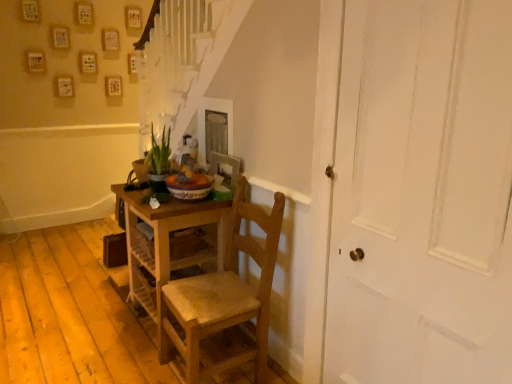
Describe the element at coordinates (166, 246) in the screenshot. This screenshot has height=384, width=512. I see `wooden desk at center` at that location.

Where is `white painted wood door at right`? white painted wood door at right is located at coordinates (422, 195).

Measure the distance between point (169, 305) and camera.

Point (169, 305) and camera are 2.09 meters apart.

Identify the location of green glossy plant at center. click(x=159, y=161).

Identify the location of wooden desk at center. The height and width of the screenshot is (384, 512). (166, 246).

From the image's perspective, who appears lower, wooden chair at center or green glossy plant at center?

wooden chair at center, from the image's perspective.

Looking at this image, is wooden chair at center looking in the opposite direction of green glossy plant at center?

No, wooden chair at center is not facing away from green glossy plant at center.

Is wooden chair at center far from green glossy plant at center?

They are positioned close to each other.

Which point is more forward, (269, 225) or (152, 141)?

The point (269, 225) is more forward.

Based on the photo, would you consider wooden picture frame at center to be distant from white painted wood door at right?

Yes, wooden picture frame at center and white painted wood door at right are quite far apart.

In the scene shown: From a real-world perspective, which object stands above the other?

wooden picture frame at center.

Is wooden picture frame at center at the left side of white painted wood door at right?

Correct, you'll find wooden picture frame at center to the left of white painted wood door at right.

Could white painted wood door at right be considered to be inside wooden picture frame at center?

That's incorrect, white painted wood door at right is not inside wooden picture frame at center.

Consider the image. From the image's perspective, is wooden desk at center above wooden chair at center?

Correct, wooden desk at center appears higher than wooden chair at center in the image.

From a real-world perspective, is wooden desk at center on wooden chair at center?

Actually, wooden desk at center is physically below wooden chair at center in the real world.

How different are the orientations of wooden desk at center and wooden chair at center in degrees?

1.06 degrees separate the facing orientations of wooden desk at center and wooden chair at center.

Which object is closer to the camera, wooden desk at center or wooden chair at center?

wooden chair at center is closer to the camera.

Does wooden desk at center have a smaller size compared to wooden picture frame at center?

No.

From the image's perspective, is wooden desk at center below wooden picture frame at center?

Correct, wooden desk at center appears lower than wooden picture frame at center in the image.

Considering the sizes of objects wooden desk at center and wooden picture frame at center in the image provided, who is thinner, wooden desk at center or wooden picture frame at center?

Thinner between the two is wooden picture frame at center.

Is green glossy plant at center aimed at white painted wood door at right?

No, green glossy plant at center is not facing towards white painted wood door at right.

Is green glossy plant at center thinner than white painted wood door at right?

No, green glossy plant at center is not thinner than white painted wood door at right.

From a real-world perspective, which is physically below, green glossy plant at center or white painted wood door at right?

white painted wood door at right, from a real-world perspective.

Can you confirm if green glossy plant at center is bigger than white painted wood door at right?

No, green glossy plant at center is not bigger than white painted wood door at right.

From the image's perspective, is wooden picture frame at center above wooden chair at center?

Yes, from the image's perspective, wooden picture frame at center is on top of wooden chair at center.

Does wooden picture frame at center turn towards wooden chair at center?

No, wooden picture frame at center is not turned towards wooden chair at center.

Visually, is wooden picture frame at center positioned to the left or to the right of wooden chair at center?

wooden picture frame at center is to the right of wooden chair at center.

Do you think wooden picture frame at center is within wooden chair at center, or outside of it?

wooden picture frame at center is located beyond the bounds of wooden chair at center.

Which object is positioned more to the right, green glossy plant at center or wooden picture frame at center?

Positioned to the right is wooden picture frame at center.

Is green glossy plant at center placed right next to wooden picture frame at center?

No, green glossy plant at center is not beside wooden picture frame at center.

The image size is (512, 384). Identify the location of houseplant on the left of wooden picture frame at center. (159, 161).

From the image's perspective, between green glossy plant at center and wooden picture frame at center, who is located below?

wooden picture frame at center is shown below in the image.

The width and height of the screenshot is (512, 384). I want to click on chair below the green glossy plant at center (from the image's perspective), so click(227, 294).

Where is `picture frame that appears on the left of white painted wood door at right`? This screenshot has height=384, width=512. picture frame that appears on the left of white painted wood door at right is located at coordinates (225, 174).

Looking at the image, which one is located further to green glossy plant at center, wooden chair at center or white painted wood door at right?

white painted wood door at right.

Based on their spatial positions, is white painted wood door at right or wooden chair at center further from green glossy plant at center?

Among the two, white painted wood door at right is located further to green glossy plant at center.

Considering their positions, is green glossy plant at center positioned closer to wooden desk at center than wooden picture frame at center?

The object closer to wooden desk at center is green glossy plant at center.

In the scene shown: Estimate the real-world distances between objects in this image. Which object is closer to green glossy plant at center, wooden picture frame at center or wooden desk at center?

wooden picture frame at center is positioned closer to the anchor green glossy plant at center.

Looking at the image, which one is located closer to wooden chair at center, white painted wood door at right or wooden picture frame at center?

Based on the image, wooden picture frame at center appears to be nearer to wooden chair at center.

From the image, which object appears to be farther from white painted wood door at right, wooden picture frame at center or green glossy plant at center?

green glossy plant at center is further to white painted wood door at right.

Estimate the real-world distances between objects in this image. Which object is closer to wooden desk at center, wooden picture frame at center or white painted wood door at right?

The object closer to wooden desk at center is wooden picture frame at center.

Based on their spatial positions, is wooden desk at center or white painted wood door at right closer to wooden picture frame at center?

The object closer to wooden picture frame at center is wooden desk at center.

Locate an element on the screen. This screenshot has height=384, width=512. picture frame between green glossy plant at center and wooden chair at center in the vertical direction is located at coordinates (225, 174).

Locate an element on the screen. The width and height of the screenshot is (512, 384). houseplant between white painted wood door at right and wooden picture frame at center along the z-axis is located at coordinates (159, 161).

Find the location of `picture frame that lies between green glossy plant at center and wooden desk at center from top to bottom`. picture frame that lies between green glossy plant at center and wooden desk at center from top to bottom is located at coordinates (225, 174).

At what (x,y) coordinates should I click in order to perform the action: click on chair between white painted wood door at right and wooden desk at center from front to back. Please return your answer as a coordinate pair (x, y). The height and width of the screenshot is (384, 512). Looking at the image, I should click on (227, 294).